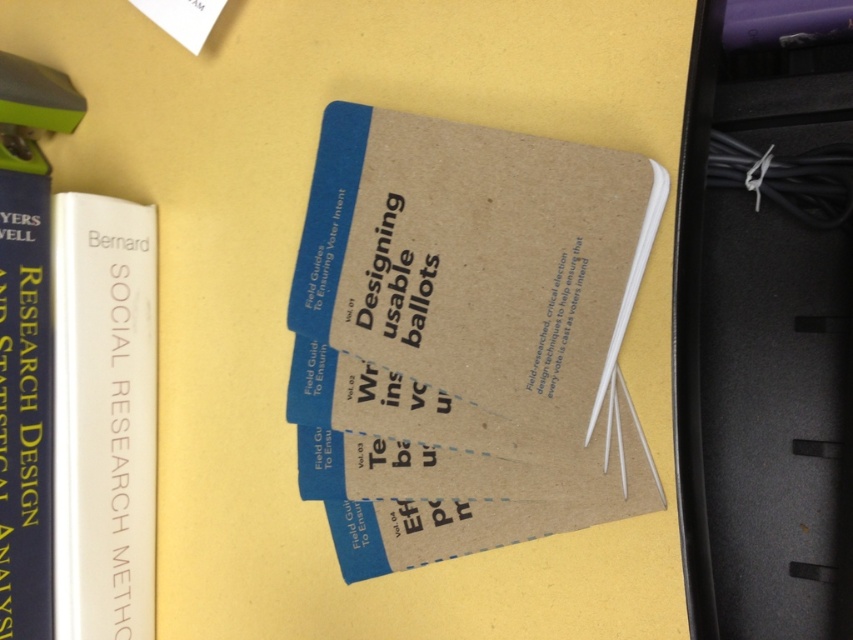
Question: Does kraft paper notebook at center have a larger size compared to matte blue book at left?

Choices:
 (A) yes
 (B) no

Answer: (A)

Question: Can you confirm if kraft paper notebook at center is smaller than white matte book at left?

Choices:
 (A) yes
 (B) no

Answer: (B)

Question: Which of the following is the farthest from the observer?

Choices:
 (A) white matte book at left
 (B) kraft paper notebook at center
 (C) matte blue book at left

Answer: (A)

Question: Does kraft paper notebook at center appear over white matte book at left?

Choices:
 (A) no
 (B) yes

Answer: (B)

Question: Which point appears closest to the camera in this image?

Choices:
 (A) (440, 298)
 (B) (47, 474)

Answer: (A)

Question: Which point is closer to the camera taking this photo?

Choices:
 (A) (57, 244)
 (B) (24, 525)
 (C) (625, 464)

Answer: (C)